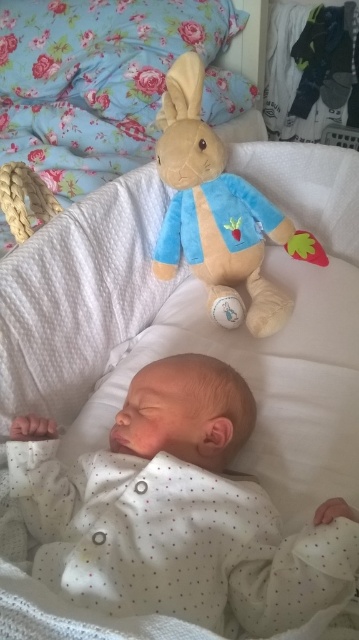
Between point (268, 509) and point (183, 200), which one is positioned behind?

Positioned behind is point (183, 200).

Is white dotted fabric at center smaller than soft plush rabbit at upper center?

Yes, white dotted fabric at center is smaller than soft plush rabbit at upper center.

Is point (137, 474) positioned before point (239, 273)?

Yes, it is in front of point (239, 273).

I want to click on white dotted fabric at center, so coord(176,512).